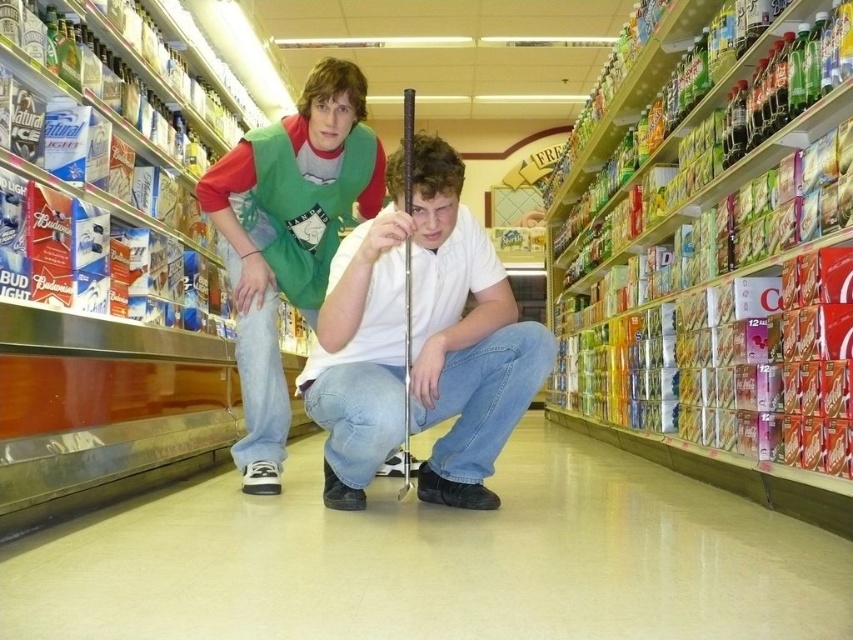
Question: Can you confirm if white matte shirt at center is positioned to the left of green fabric vest at center?

Choices:
 (A) no
 (B) yes

Answer: (A)

Question: Which point appears closest to the camera in this image?

Choices:
 (A) (277, 365)
 (B) (438, 368)

Answer: (B)

Question: Can you confirm if white matte shirt at center is positioned to the left of green fabric vest at center?

Choices:
 (A) yes
 (B) no

Answer: (B)

Question: Can you confirm if white matte shirt at center is bigger than green fabric vest at center?

Choices:
 (A) no
 (B) yes

Answer: (B)

Question: Which point appears closest to the camera in this image?

Choices:
 (A) (318, 342)
 (B) (326, 92)

Answer: (A)

Question: Among these points, which one is farthest from the camera?

Choices:
 (A) (352, 410)
 (B) (263, 272)

Answer: (B)